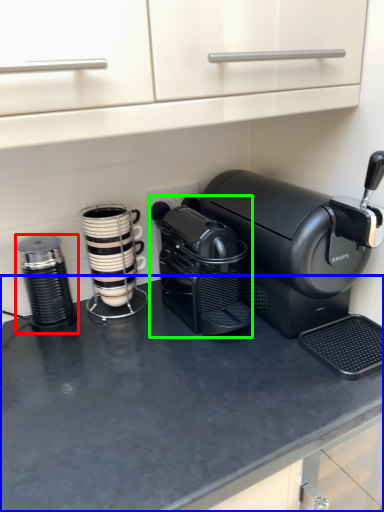
Question: Which object is positioned closest to kitchen appliance (highlighted by a red box)? Select from counter top (highlighted by a blue box) and coffee maker (highlighted by a green box).

Choices:
 (A) counter top
 (B) coffee maker

Answer: (B)